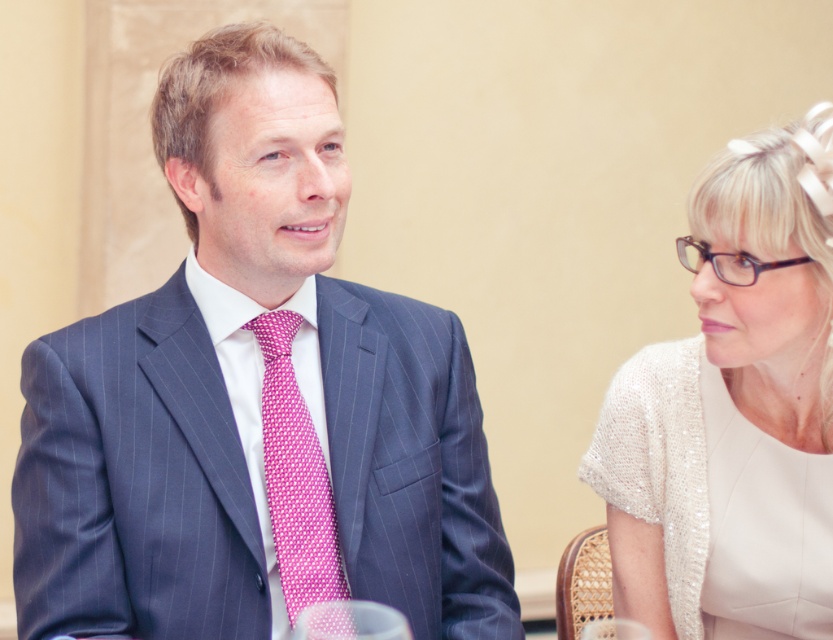
Who is higher up, blue pinstripe suit at left or pink dotted fabric tie at center?

Positioned higher is blue pinstripe suit at left.

Is blue pinstripe suit at left wider than pink dotted fabric tie at center?

Yes, blue pinstripe suit at left is wider than pink dotted fabric tie at center.

The height and width of the screenshot is (640, 833). What do you see at coordinates (253, 401) in the screenshot?
I see `blue pinstripe suit at left` at bounding box center [253, 401].

Find the location of `blue pinstripe suit at left`. blue pinstripe suit at left is located at coordinates (253, 401).

Who is higher up, sequined beige dress at right or pink dotted fabric tie at center?

sequined beige dress at right is higher up.

Is sequined beige dress at right to the left of pink dotted fabric tie at center from the viewer's perspective?

Incorrect, sequined beige dress at right is not on the left side of pink dotted fabric tie at center.

Where is `sequined beige dress at right`? The image size is (833, 640). sequined beige dress at right is located at coordinates (732, 412).

Is blue pinstripe suit at left to the right of sequined beige dress at right from the viewer's perspective?

No, blue pinstripe suit at left is not to the right of sequined beige dress at right.

Can you confirm if blue pinstripe suit at left is positioned below sequined beige dress at right?

Actually, blue pinstripe suit at left is above sequined beige dress at right.

Image resolution: width=833 pixels, height=640 pixels. What are the coordinates of `blue pinstripe suit at left` in the screenshot? It's located at (253, 401).